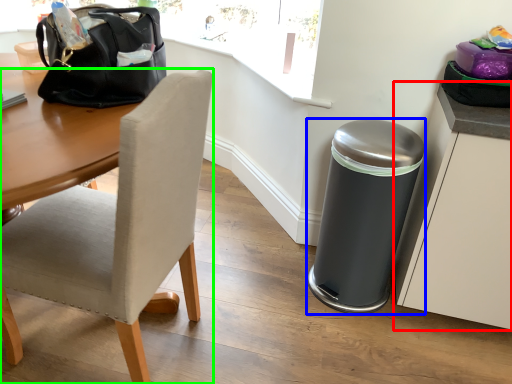
Question: Based on their relative distances, which object is nearer to cabinetry (highlighted by a red box)? Choose from trash bin/can (highlighted by a blue box) and chair (highlighted by a green box).

Choices:
 (A) trash bin/can
 (B) chair

Answer: (A)